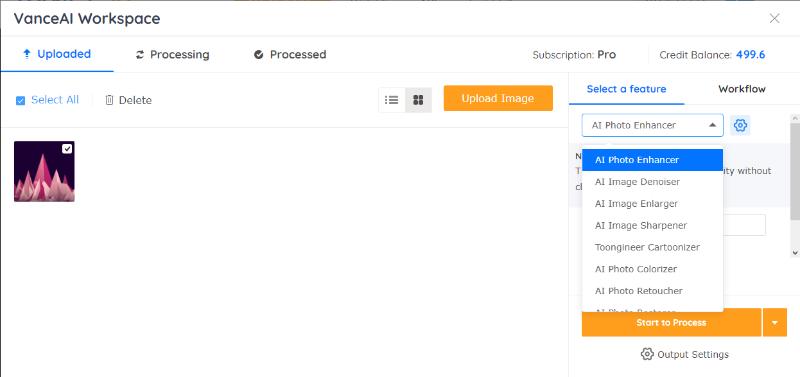
The height and width of the screenshot is (377, 800). In order to click on picture in this screenshot , I will do `click(36, 180)`, `click(737, 124)`, `click(645, 356)`.